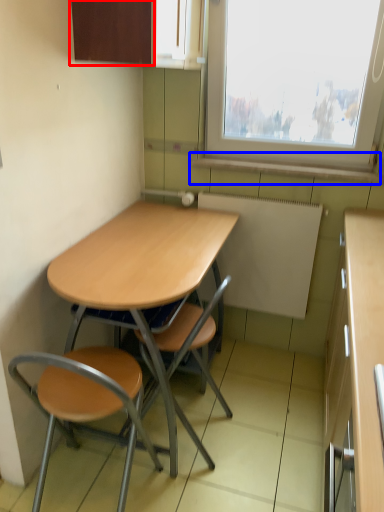
Question: Which object is further to the camera taking this photo, cabinetry (highlighted by a red box) or window sill (highlighted by a blue box)?

Choices:
 (A) cabinetry
 (B) window sill

Answer: (B)